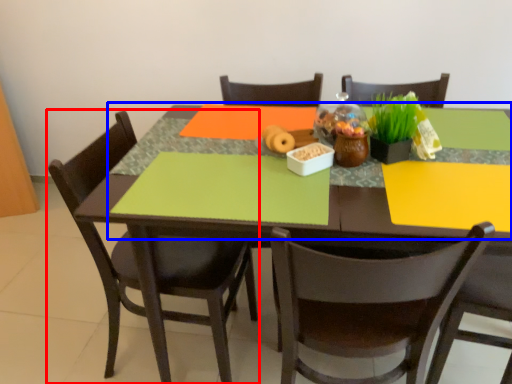
Question: Which of the following is the farthest to the observer, chair (highlighted by a red box) or tablecloth (highlighted by a blue box)?

Choices:
 (A) chair
 (B) tablecloth

Answer: (A)